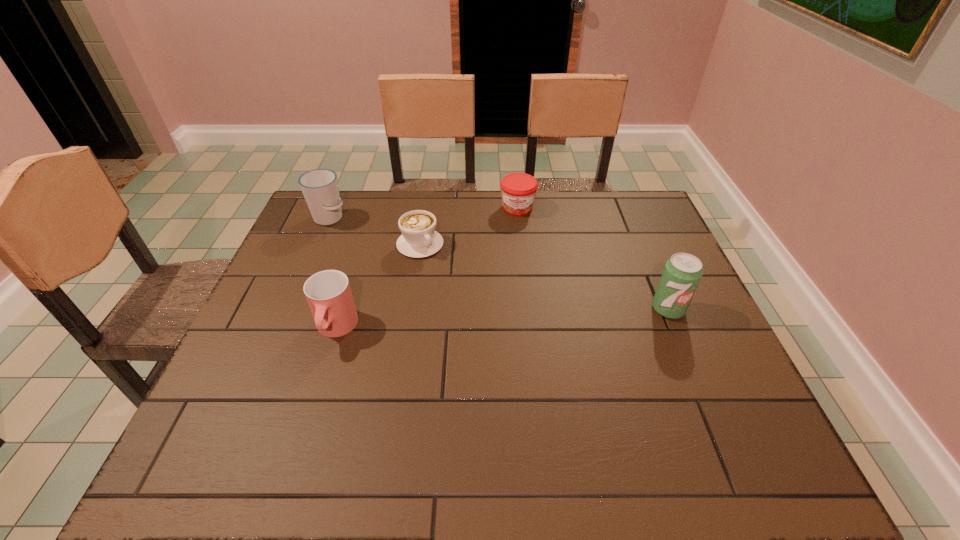
At what (x,y) coordinates should I click in order to perform the action: click on vacant spot on the desktop that is between the second object from left to right and the soda and is positioned to the right of the third object from right to left's handle. Please return your answer as a coordinate pair (x, y). The image size is (960, 540). Looking at the image, I should click on (492, 320).

Identify the location of vacant spot on the desktop that is between the nearer cup and the rightmost object and is positioned on the label side of the jam. point(515,318).

Image resolution: width=960 pixels, height=540 pixels. What are the coordinates of `vacant spot on the desktop that is between the second object from left to right and the rightmost object and is positioned with a handle on the side of the leftmost object` in the screenshot? It's located at (465, 321).